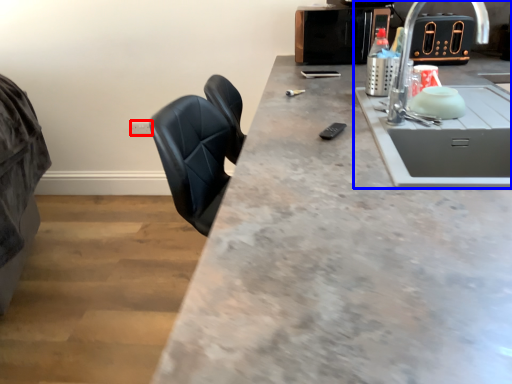
Question: Among these objects, which one is nearest to the camera, electric outlet (highlighted by a red box) or sink (highlighted by a blue box)?

Choices:
 (A) electric outlet
 (B) sink

Answer: (B)